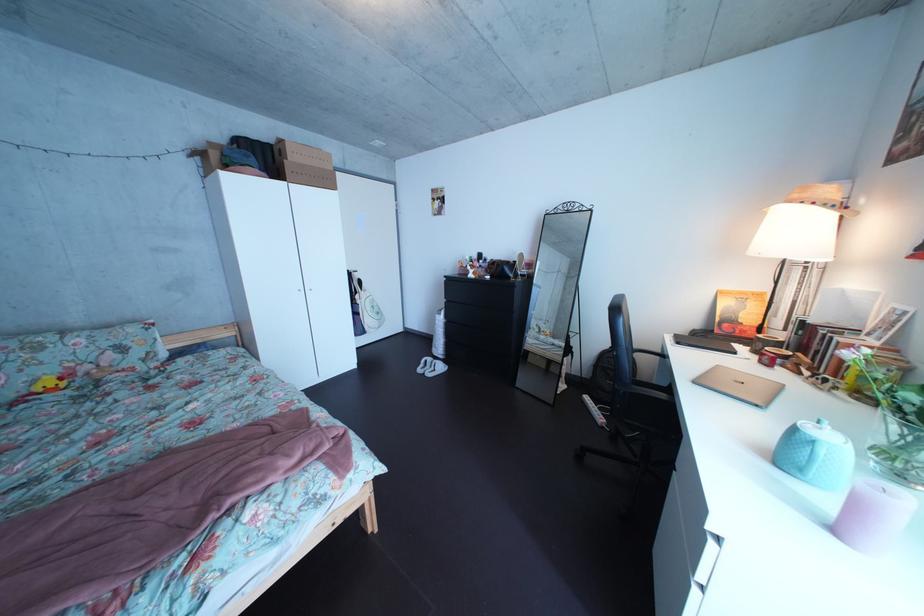
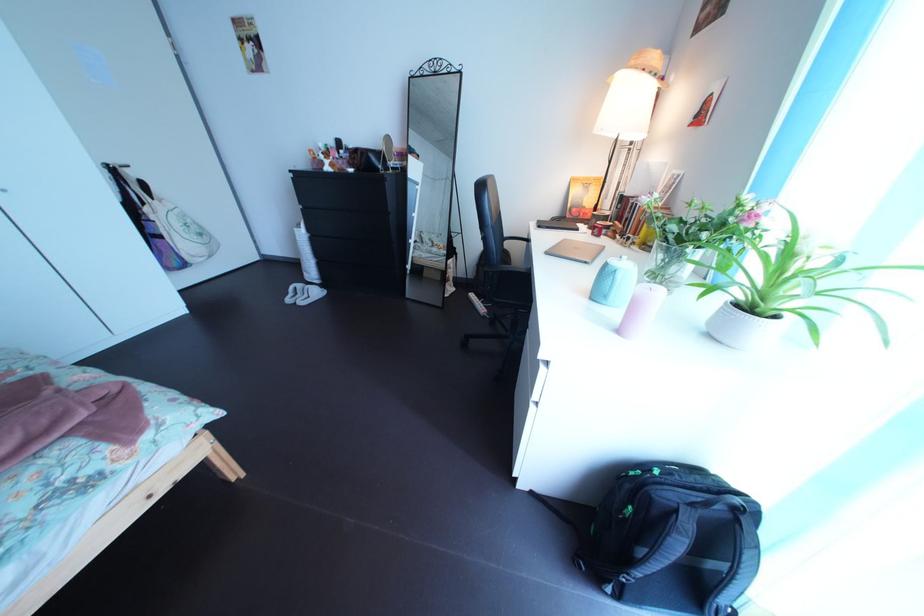
Where in the second image is the point corresponding to [825,484] from the first image?

(626, 307)